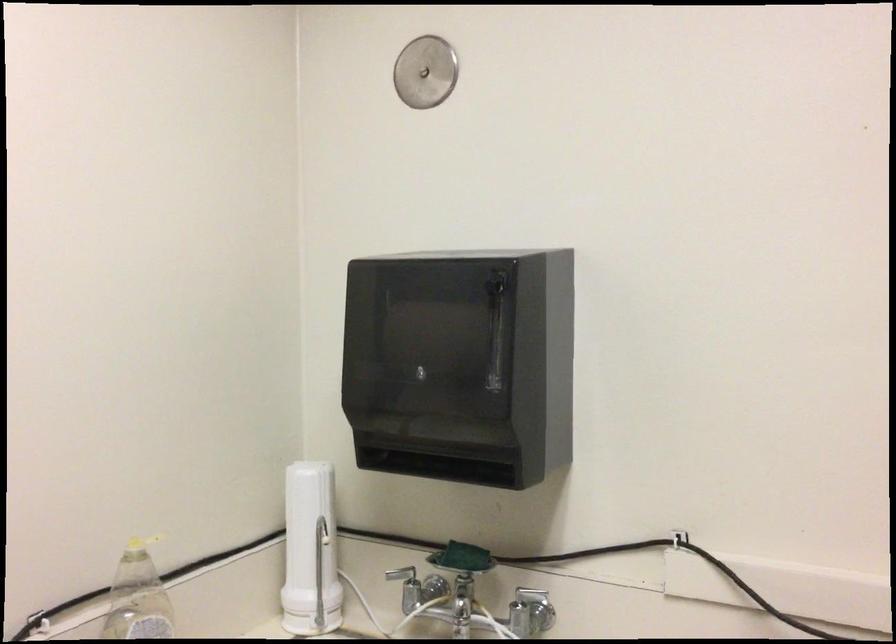
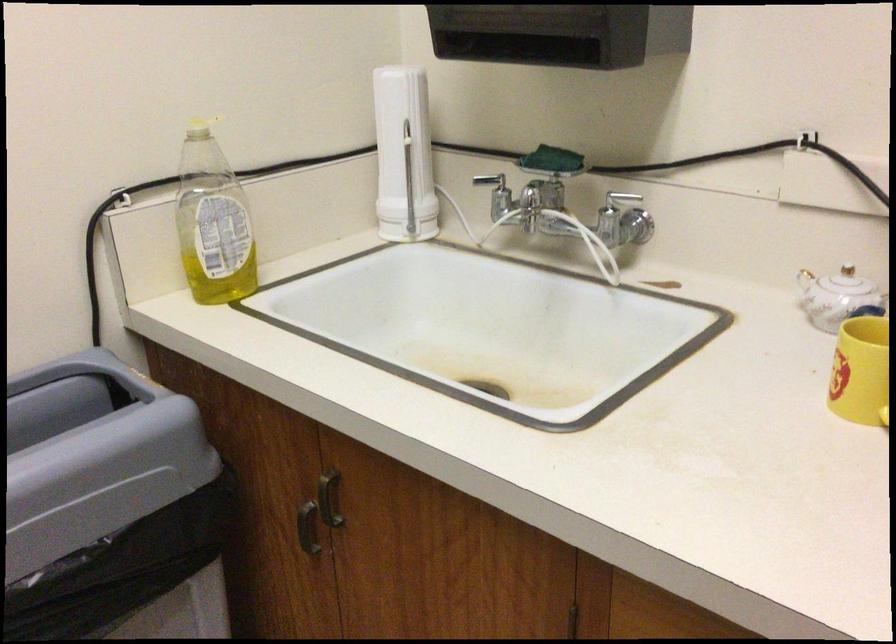
The point at (463,556) is marked in the first image. Where is the corresponding point in the second image?

(552, 160)